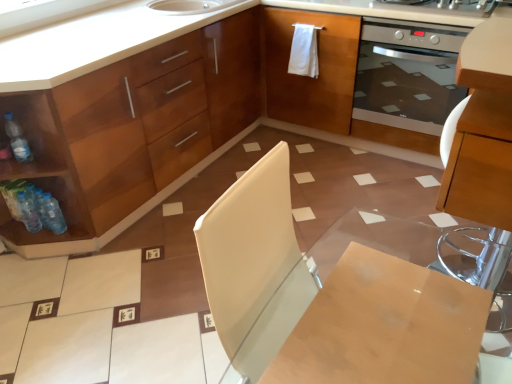
Find the location of a particular element. free location above wooden table at center (from a real-world perspective) is located at coordinates (386, 326).